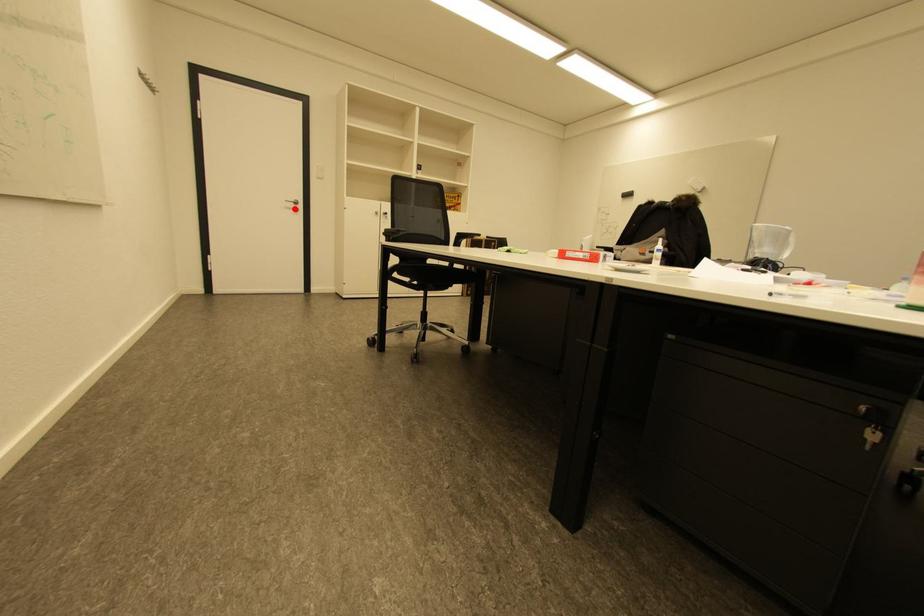
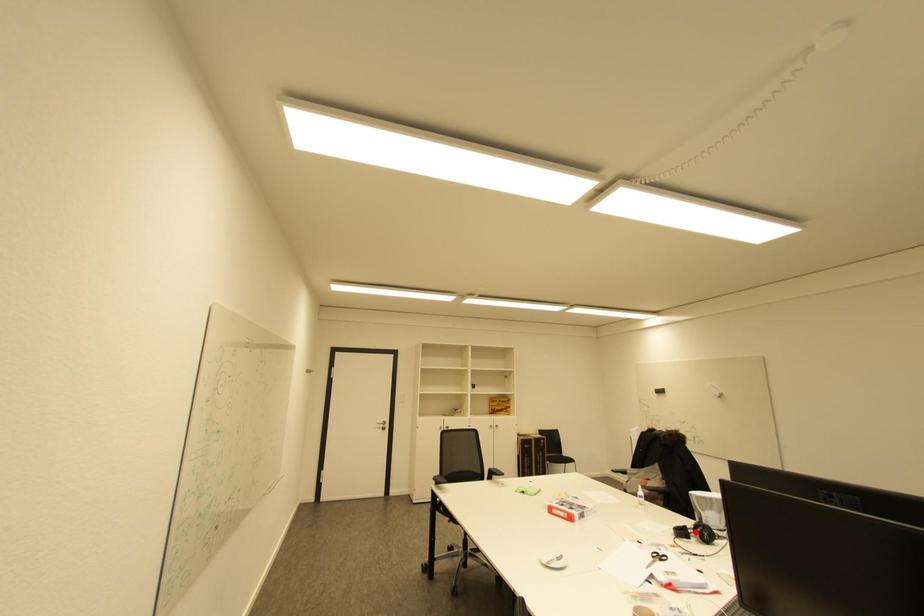
I am providing you with two images of the same scene from different viewpoints. A red point is marked on the first image and another point is marked on the second image. Is the marked point in image1 the same physical position as the marked point in image2?

No